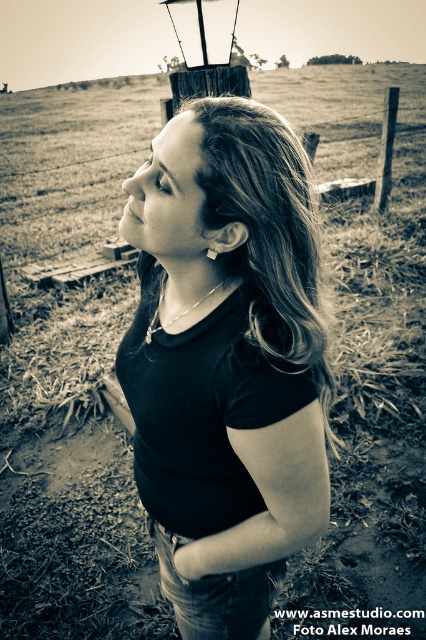
Can you confirm if black matte shirt at center is smaller than dirt field at center?

Correct, black matte shirt at center occupies less space than dirt field at center.

Based on the photo, can you confirm if black matte shirt at center is bigger than dirt field at center?

No, black matte shirt at center is not bigger than dirt field at center.

Does point (201, 493) come closer to viewer compared to point (370, 81)?

Yes, point (201, 493) is closer to viewer.

Where is `black matte shirt at center`? The width and height of the screenshot is (426, 640). black matte shirt at center is located at coordinates (226, 362).